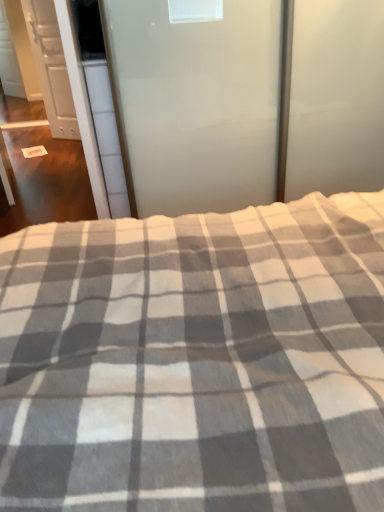
Question: Is gray checkered blanket at center facing away from frosted glass screen door at upper center, the first screen door from the right?

Choices:
 (A) no
 (B) yes

Answer: (A)

Question: Can you confirm if gray checkered blanket at center is thinner than frosted glass screen door at upper center, the second screen door from the left?

Choices:
 (A) yes
 (B) no

Answer: (B)

Question: From a real-world perspective, is gray checkered blanket at center located beneath frosted glass screen door at upper center, the second screen door from the left?

Choices:
 (A) no
 (B) yes

Answer: (A)

Question: Is gray checkered blanket at center positioned in front of frosted glass screen door at upper center, the first screen door from the right?

Choices:
 (A) yes
 (B) no

Answer: (A)

Question: From a real-world perspective, is gray checkered blanket at center positioned over frosted glass screen door at upper center, the first screen door from the front, based on gravity?

Choices:
 (A) no
 (B) yes

Answer: (B)

Question: Is gray checkered blanket at center positioned behind frosted glass screen door at upper center, which ranks as the second screen door in back-to-front order?

Choices:
 (A) yes
 (B) no

Answer: (B)

Question: Does white glossy door at upper left, the 2th screen door viewed from the front, lie behind gray checkered blanket at center?

Choices:
 (A) yes
 (B) no

Answer: (A)

Question: Is white glossy door at upper left, which is the 1th screen door from left to right, not inside gray checkered blanket at center?

Choices:
 (A) no
 (B) yes

Answer: (B)

Question: Considering the relative sizes of white glossy door at upper left, which is the 1th screen door from left to right, and gray checkered blanket at center in the image provided, is white glossy door at upper left, which is the 1th screen door from left to right, bigger than gray checkered blanket at center?

Choices:
 (A) no
 (B) yes

Answer: (A)

Question: Can you confirm if white glossy door at upper left, the 2th screen door viewed from the front, is taller than gray checkered blanket at center?

Choices:
 (A) no
 (B) yes

Answer: (B)

Question: Does white glossy door at upper left, the first screen door from the back, have a smaller size compared to gray checkered blanket at center?

Choices:
 (A) yes
 (B) no

Answer: (A)

Question: Is white glossy door at upper left, the first screen door from the back, to the left of gray checkered blanket at center from the viewer's perspective?

Choices:
 (A) yes
 (B) no

Answer: (A)

Question: Does frosted glass screen door at upper center, the first screen door from the right, lie in front of white matte cabinet at left?

Choices:
 (A) no
 (B) yes

Answer: (B)